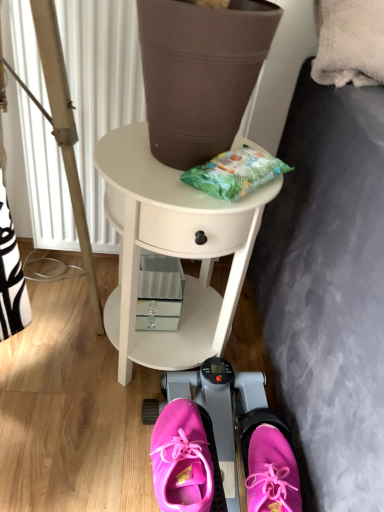
Find the location of a particular element. Image resolution: width=384 pixels, height=512 pixels. unoccupied area in front of wooden tripod at left is located at coordinates (45, 339).